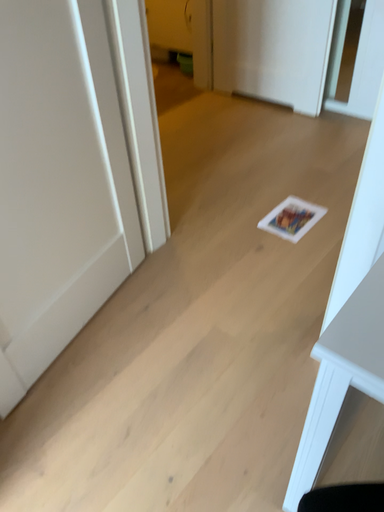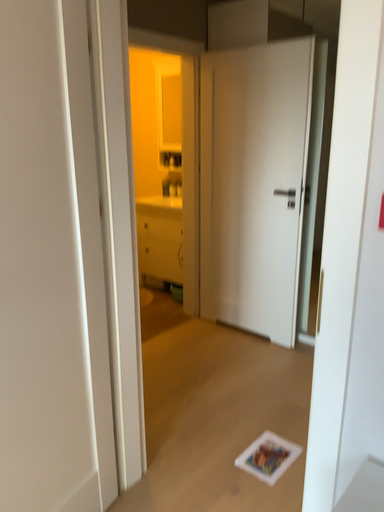
Question: Which way did the camera rotate in the video?

Choices:
 (A) rotated upward
 (B) rotated downward

Answer: (A)